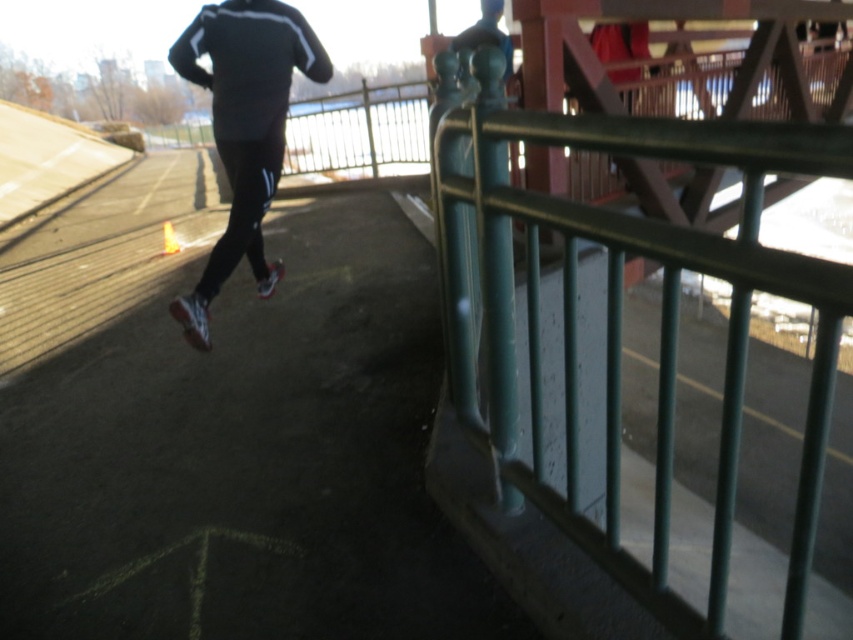
The width and height of the screenshot is (853, 640). Describe the element at coordinates (247, 112) in the screenshot. I see `matte black running suit at left` at that location.

Locate an element on the screen. The image size is (853, 640). matte black running suit at left is located at coordinates [247, 112].

Does matte black running suit at left appear on the left side of shiny red shoe at lower left?

Incorrect, matte black running suit at left is not on the left side of shiny red shoe at lower left.

Consider the image. Can you confirm if matte black running suit at left is bigger than shiny red shoe at lower left?

Yes.

Which is in front, point (222, 80) or point (190, 298)?

Positioned in front is point (190, 298).

Find the location of `matte black running suit at left`. matte black running suit at left is located at coordinates (247, 112).

Which is behind, point (721, 573) or point (274, 145)?

Point (274, 145)

Can you confirm if green painted metal railing at center is positioned to the left of matte black running suit at left?

In fact, green painted metal railing at center is to the right of matte black running suit at left.

The width and height of the screenshot is (853, 640). I want to click on green painted metal railing at center, so click(x=619, y=301).

Identify the location of green painted metal railing at center. Image resolution: width=853 pixels, height=640 pixels. (619, 301).